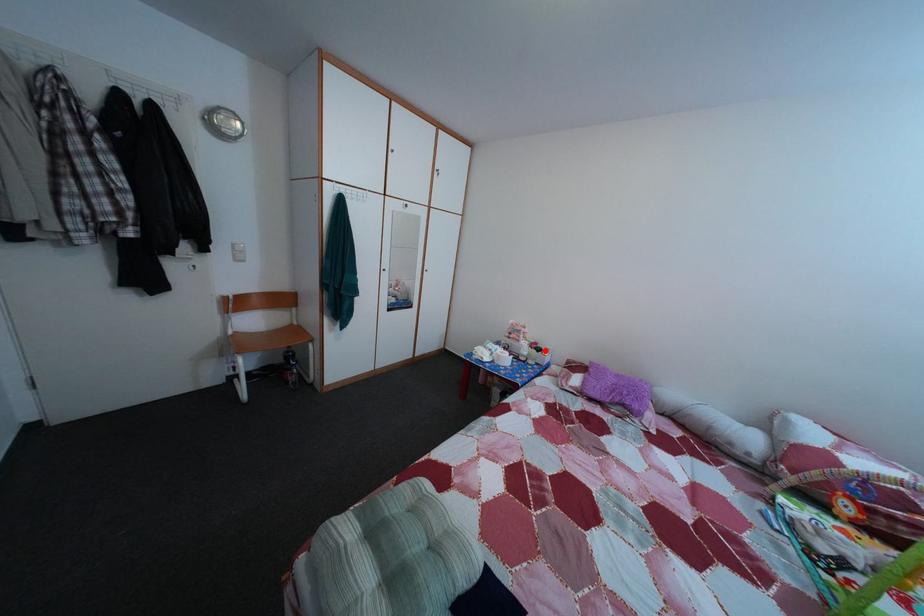
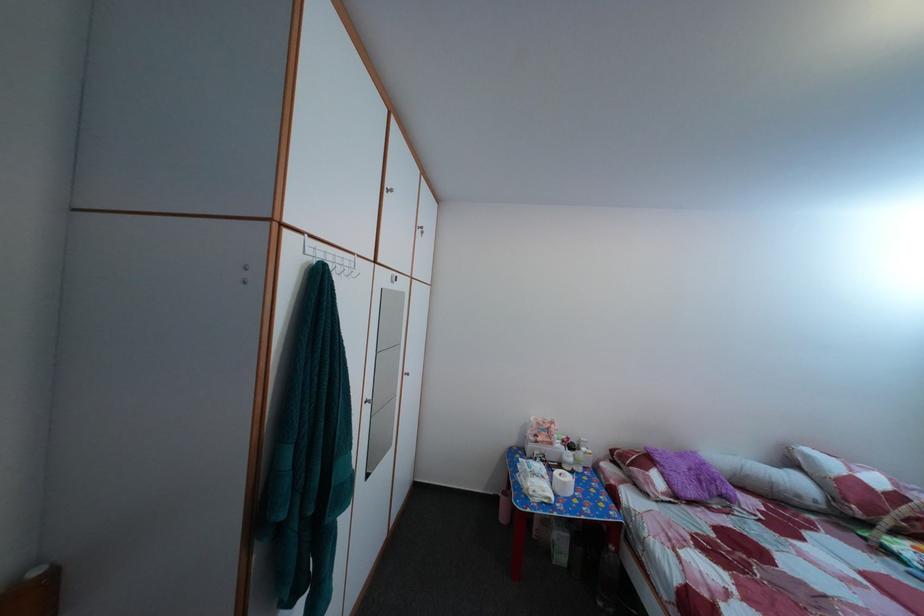
Question: I am providing you with two images of the same scene from different viewpoints. A red point is shown in image1. For the corresponding object point in image2, is it positioned nearer or farther from the camera?

Choices:
 (A) Nearer
 (B) Farther

Answer: (B)